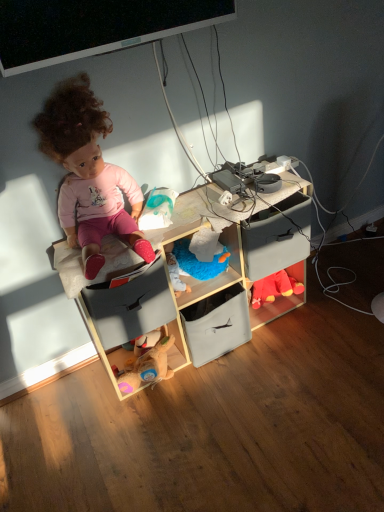
Question: Is soft fabric storage at center, positioned as the second shelf in left-to-right order, facing away from matte plastic bag at center, the first toy in the left-to-right sequence?

Choices:
 (A) yes
 (B) no

Answer: (B)

Question: Considering the relative positions of soft fabric storage at center, marked as the first shelf in a right-to-left arrangement, and matte plastic bag at center, which is the 1th toy from top to bottom, in the image provided, is soft fabric storage at center, marked as the first shelf in a right-to-left arrangement, in front of matte plastic bag at center, which is the 1th toy from top to bottom,?

Choices:
 (A) no
 (B) yes

Answer: (A)

Question: Does soft fabric storage at center, positioned as the second shelf in left-to-right order, have a larger size compared to matte plastic bag at center, placed as the 1th toy when sorted from front to back?

Choices:
 (A) no
 (B) yes

Answer: (B)

Question: Does soft fabric storage at center, positioned as the second shelf in left-to-right order, have a greater width compared to matte plastic bag at center, the first toy in the left-to-right sequence?

Choices:
 (A) yes
 (B) no

Answer: (A)

Question: Can you confirm if soft fabric storage at center, positioned as the second shelf in left-to-right order, is thinner than matte plastic bag at center, placed as the 1th toy when sorted from front to back?

Choices:
 (A) no
 (B) yes

Answer: (A)

Question: Can you confirm if soft fabric storage at center, positioned as the second shelf in left-to-right order, is positioned to the left of matte plastic bag at center, the 2th toy viewed from the right?

Choices:
 (A) no
 (B) yes

Answer: (A)

Question: Is matte pink doll at upper left positioned beyond the bounds of matte plastic bag at center, the second toy in the bottom-to-top sequence?

Choices:
 (A) no
 (B) yes

Answer: (B)

Question: Is the position of matte pink doll at upper left more distant than that of matte plastic bag at center, placed as the 1th toy when sorted from front to back?

Choices:
 (A) no
 (B) yes

Answer: (A)

Question: From the image's perspective, is matte pink doll at upper left located above matte plastic bag at center, the 2th toy viewed from the right?

Choices:
 (A) no
 (B) yes

Answer: (B)

Question: From the image's perspective, is matte pink doll at upper left below matte plastic bag at center, the first toy in the left-to-right sequence?

Choices:
 (A) yes
 (B) no

Answer: (B)

Question: Is matte pink doll at upper left bigger than matte plastic bag at center, marked as the 2th toy in a back-to-front arrangement?

Choices:
 (A) yes
 (B) no

Answer: (A)

Question: Is matte pink doll at upper left positioned with its back to matte plastic bag at center, which is the 1th toy from top to bottom?

Choices:
 (A) yes
 (B) no

Answer: (B)

Question: From the image's perspective, would you say velvet red plush toy at lower right, placed as the second toy when sorted from left to right, is shown under matte gray drawer at center, which is the 1th drawer in right-to-left order?

Choices:
 (A) yes
 (B) no

Answer: (A)